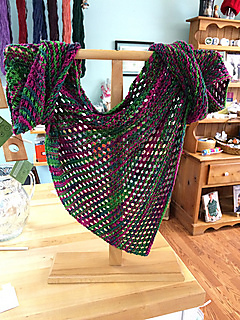
This screenshot has width=240, height=320. In order to click on picture in this screenshot , I will do `click(211, 215)`, `click(236, 198)`.